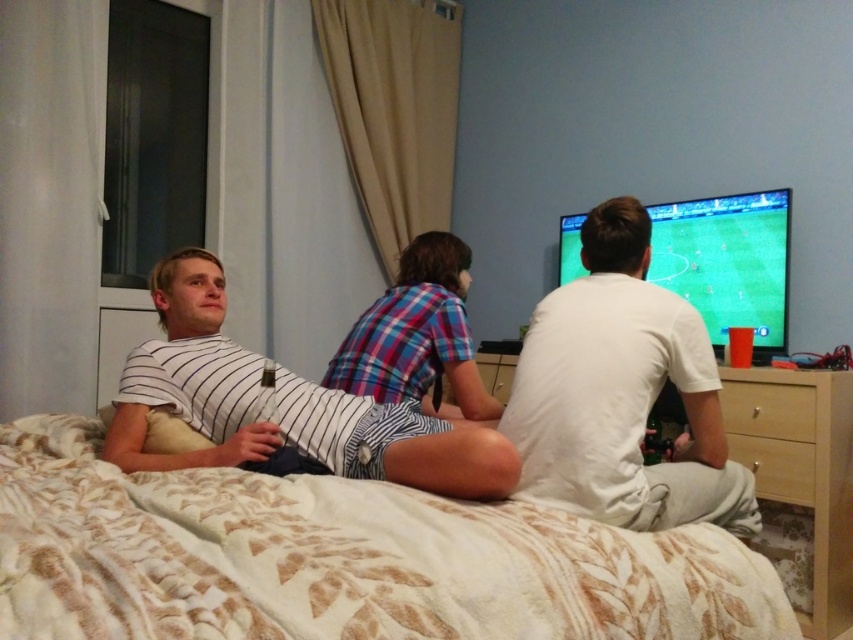
Who is positioned more to the right, white textured bed at lower left or white striped shirt at center?

white striped shirt at center is more to the right.

In the scene shown: Is white textured bed at lower left thinner than white striped shirt at center?

Incorrect, white textured bed at lower left's width is not less than white striped shirt at center's.

Does point (631, 532) come closer to viewer compared to point (553, 480)?

Yes, it is.

This screenshot has height=640, width=853. What are the coordinates of `white textured bed at lower left` in the screenshot? It's located at (340, 560).

Between white textured bed at lower left and white matte shirt at center, which one has less height?

white textured bed at lower left is shorter.

Does point (199, 536) come closer to viewer compared to point (590, 476)?

Yes, point (199, 536) is closer to viewer.

The height and width of the screenshot is (640, 853). In order to click on white textured bed at lower left in this screenshot , I will do pyautogui.click(x=340, y=560).

Is white matte shirt at center wider than white striped shirt at left?

In fact, white matte shirt at center might be narrower than white striped shirt at left.

Which is more to the left, white matte shirt at center or white striped shirt at left?

white striped shirt at left

The image size is (853, 640). Identify the location of white matte shirt at center. (621, 394).